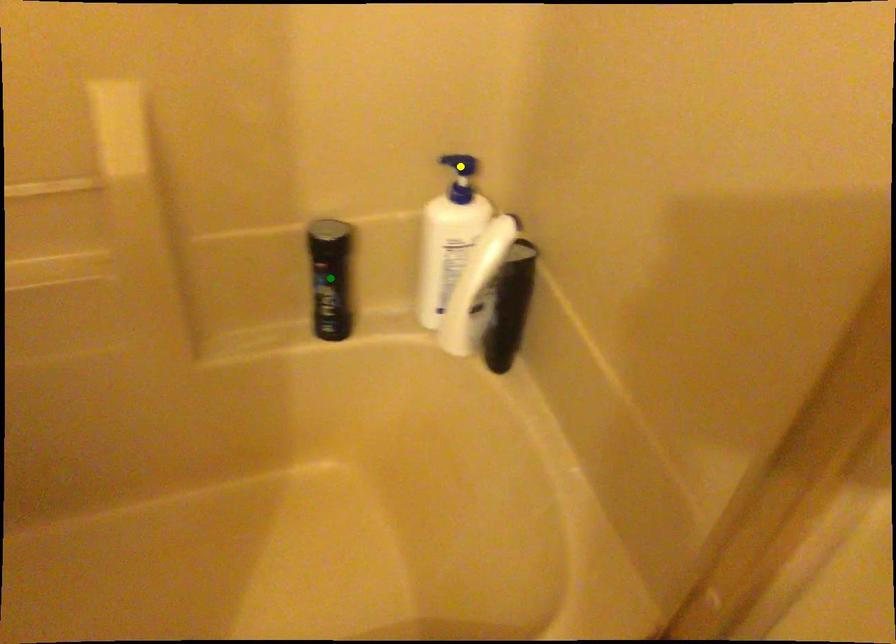
Order these from nearest to farthest:
A) yellow point
B) blue point
C) green point

blue point < green point < yellow point